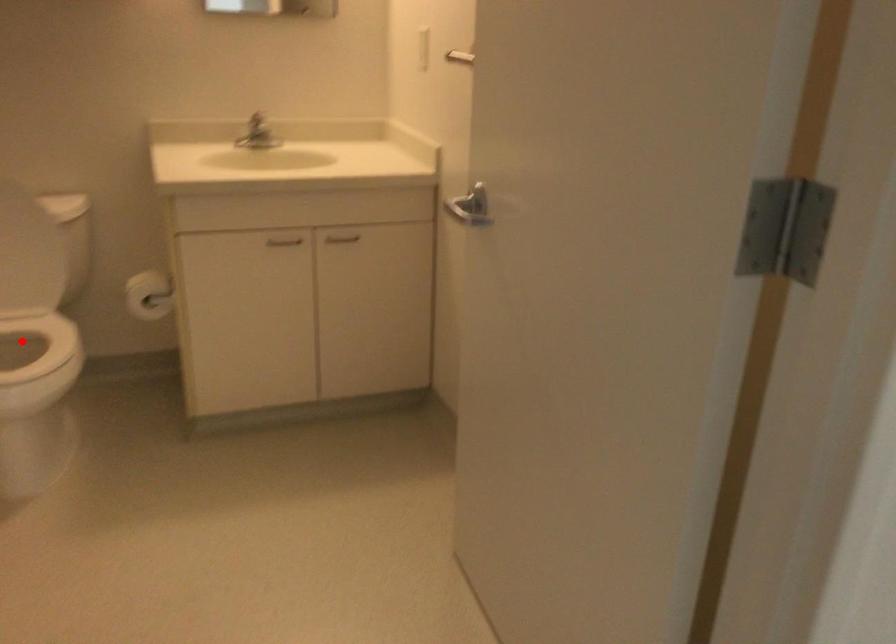
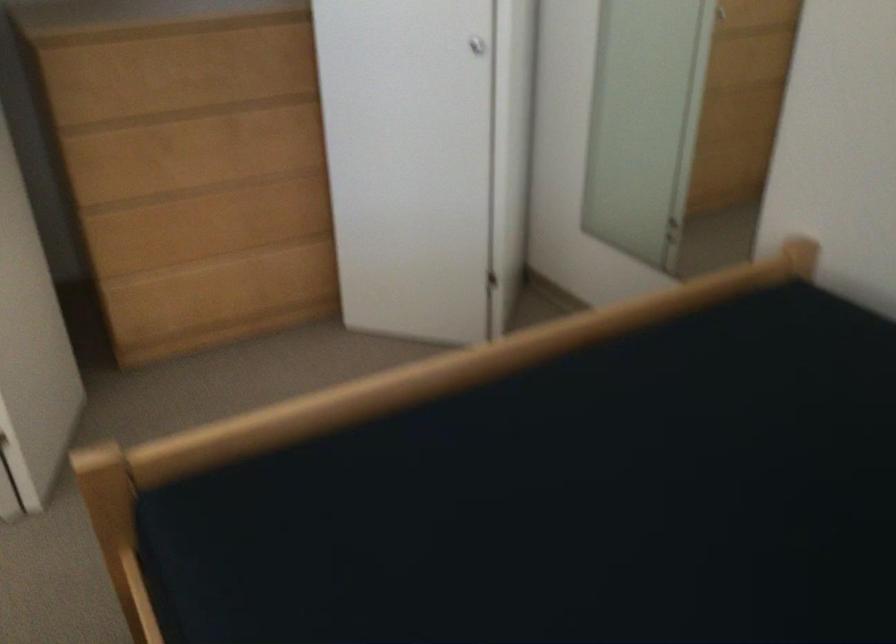
Question: I am providing you with two images of the same scene from different viewpoints. A red point is marked on the first image. At the location where the point appears in image 1, is it still visible in image 2?

Choices:
 (A) Yes
 (B) No

Answer: (B)